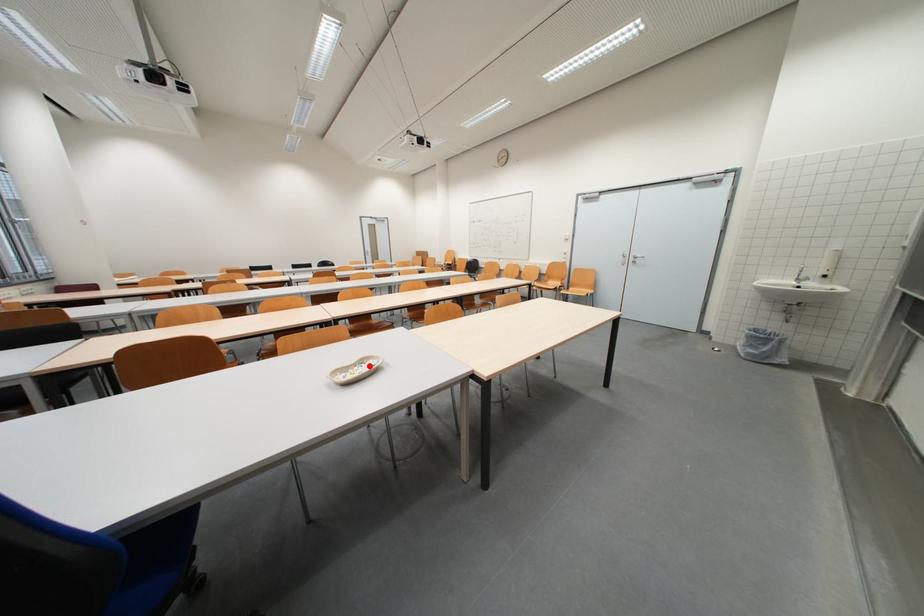
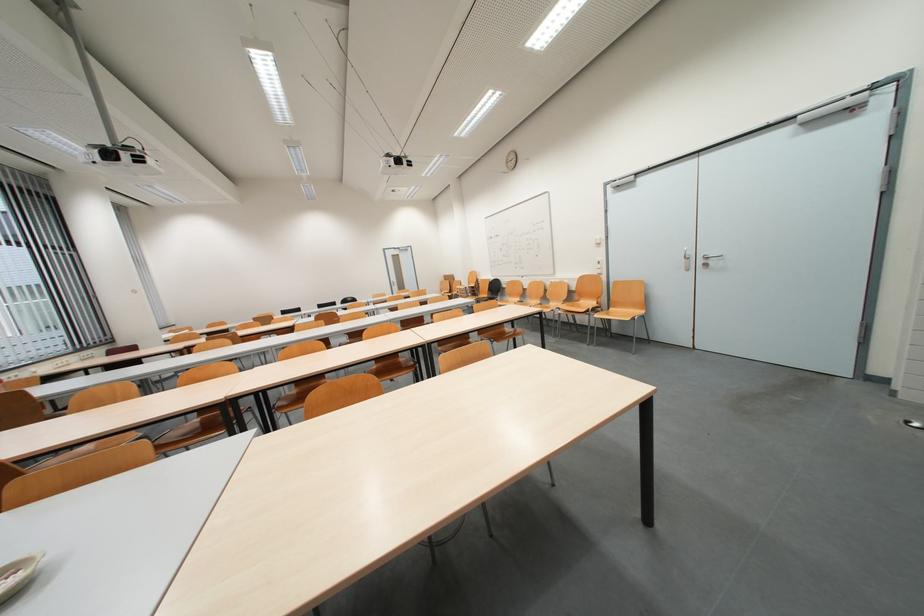
Locate, in the second image, the point that corresponds to the highlighted location in the first image.

(10, 578)